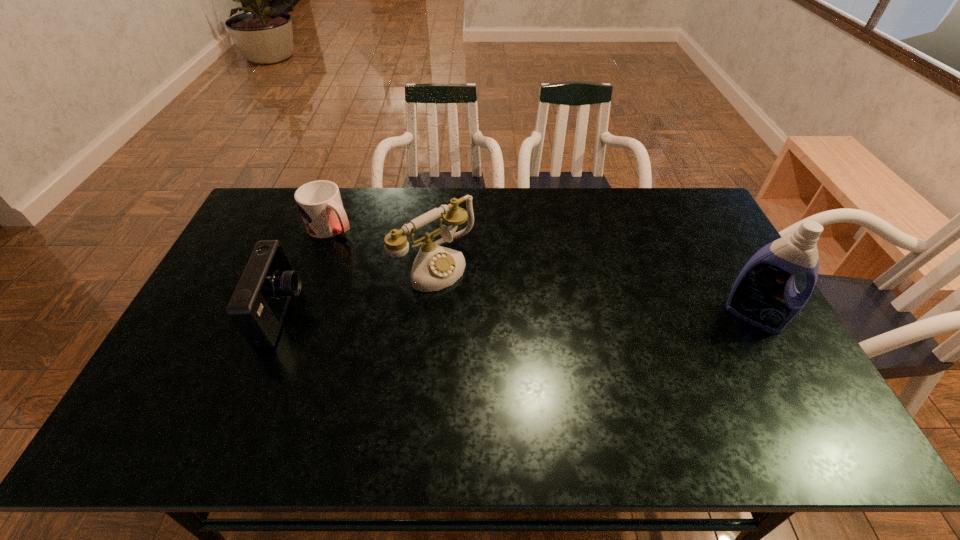
This screenshot has height=540, width=960. Find the location of `vacant space located 0.180m on the dial of the telephone`. vacant space located 0.180m on the dial of the telephone is located at coordinates coord(502,319).

Image resolution: width=960 pixels, height=540 pixels. What are the coordinates of `free space located on the side of the mug with the handle` in the screenshot? It's located at coord(410,277).

Where is `vacant area located on the side of the mug with the handle`? This screenshot has width=960, height=540. vacant area located on the side of the mug with the handle is located at coordinates 421,285.

Where is `free space located on the side of the mug with the handle`? This screenshot has height=540, width=960. free space located on the side of the mug with the handle is located at coordinates (398, 270).

Image resolution: width=960 pixels, height=540 pixels. In order to click on object that is at the far edge in this screenshot , I will do `click(319, 202)`.

Where is `object that is at the right edge`? The height and width of the screenshot is (540, 960). object that is at the right edge is located at coordinates (764, 294).

You are a GUI agent. You are given a task and a screenshot of the screen. Output one action in this format:
    pyautogui.click(x=<x>, y=<y>)
    Task: Click on the blank area at the far edge
    The width and height of the screenshot is (960, 540).
    Given the screenshot: What is the action you would take?
    pyautogui.click(x=546, y=189)

Where is `vacant space at the near edge of the desktop`? vacant space at the near edge of the desktop is located at coordinates (323, 403).

This screenshot has width=960, height=540. What are the coordinates of `vacant region at the left edge of the desktop` in the screenshot? It's located at (232, 284).

Locate an element on the screen. This screenshot has width=960, height=540. blank space at the right edge of the desktop is located at coordinates (742, 337).